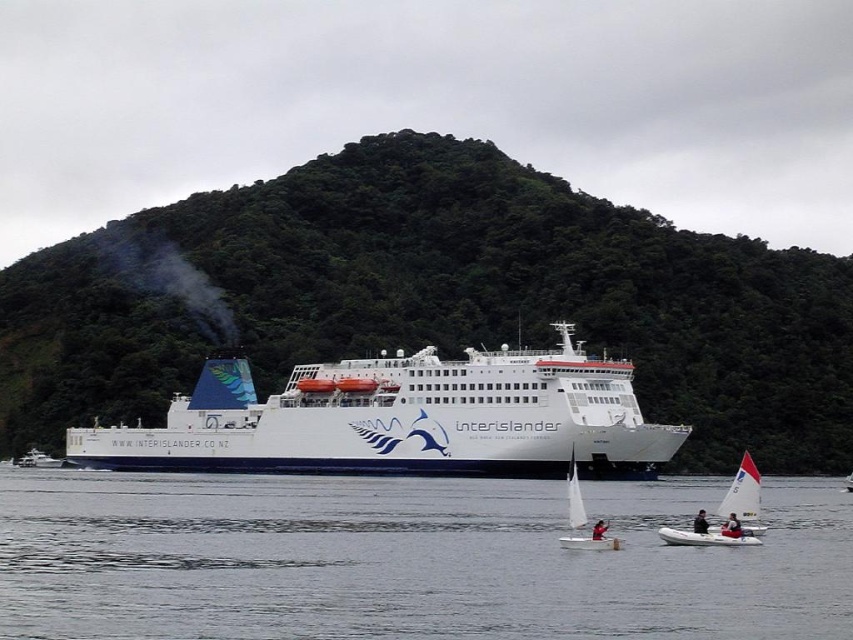
Question: Is white matte/clear ship at center below white glossy yacht at lower left?

Choices:
 (A) no
 (B) yes

Answer: (A)

Question: Can you confirm if clear water at center is positioned to the left of white matte/clear ship at center?

Choices:
 (A) yes
 (B) no

Answer: (B)

Question: Which point appears farthest from the camera in this image?

Choices:
 (A) (631, 561)
 (B) (44, 456)

Answer: (B)

Question: Among these objects, which one is farthest from the camera?

Choices:
 (A) white sailboat at lower center
 (B) white matte/clear ship at center
 (C) clear water at center

Answer: (B)

Question: Is white sailboat at lower right below white sailboat at lower center?

Choices:
 (A) yes
 (B) no

Answer: (A)

Question: Which object appears farthest from the camera in this image?

Choices:
 (A) white sailboat at lower center
 (B) white glossy yacht at lower left

Answer: (B)